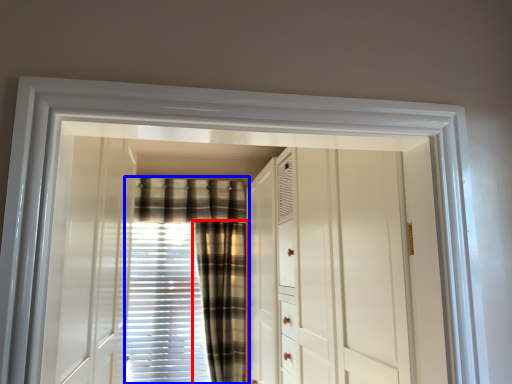
Question: Which object is closer to the camera taking this photo, curtain (highlighted by a red box) or curtain (highlighted by a blue box)?

Choices:
 (A) curtain
 (B) curtain

Answer: (A)